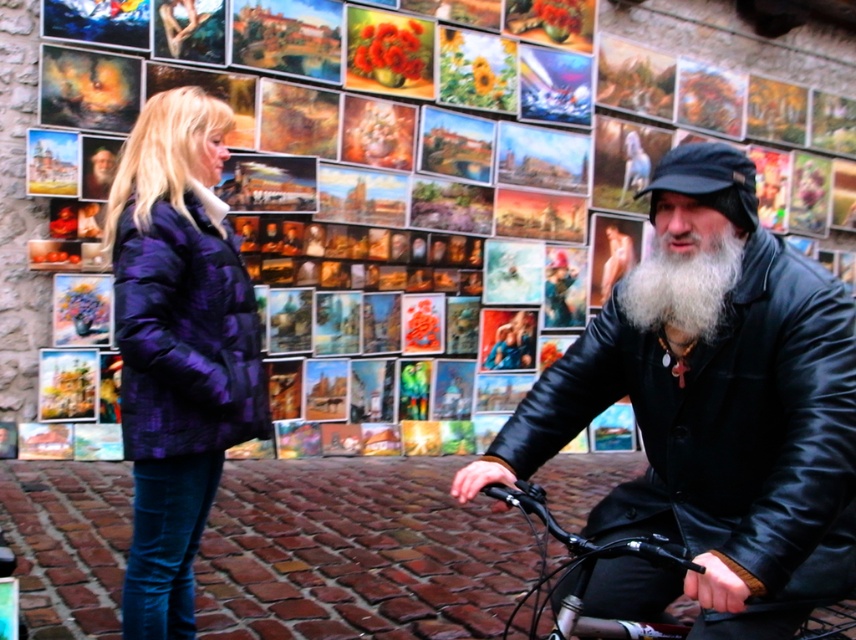
Question: Which object is farther from the camera taking this photo?

Choices:
 (A) matte black bicycle at lower right
 (B) purple quilted coat at left
 (C) purple quilted jacket at left

Answer: (A)

Question: Is matte black bicycle at lower right positioned at the back of shiny black bicycle at center?

Choices:
 (A) yes
 (B) no

Answer: (A)

Question: Can you confirm if black leather jacket at right is positioned to the left of white fluffy beard at center?

Choices:
 (A) no
 (B) yes

Answer: (B)

Question: Which object is positioned closest to the purple quilted coat at left?

Choices:
 (A) white fluffy beard at center
 (B) purple quilted jacket at left
 (C) matte black bicycle at lower right
 (D) black leather jacket at right

Answer: (B)

Question: Considering the real-world distances, which object is closest to the purple quilted coat at left?

Choices:
 (A) black leather jacket at right
 (B) purple quilted jacket at left

Answer: (B)

Question: Is black leather jacket at right above white fluffy beard at center?

Choices:
 (A) yes
 (B) no

Answer: (B)